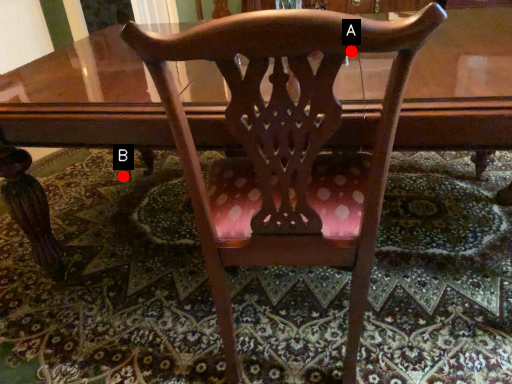
Question: Two points are circled on the image, labeled by A and B beside each circle. Which point is farther to the camera?

Choices:
 (A) A is further
 (B) B is further

Answer: (B)